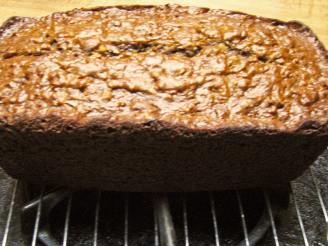
I want to click on oven rack, so click(72, 218), click(223, 221).